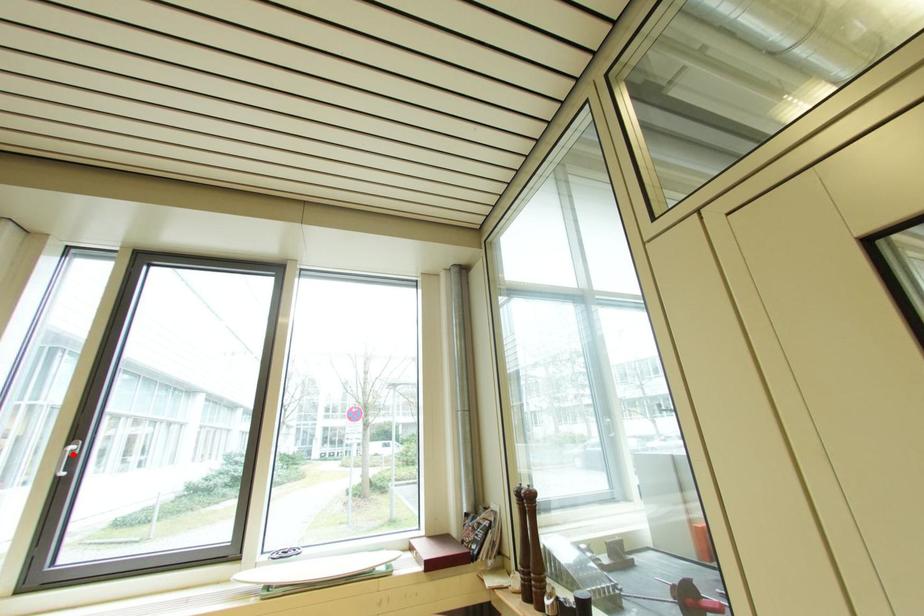
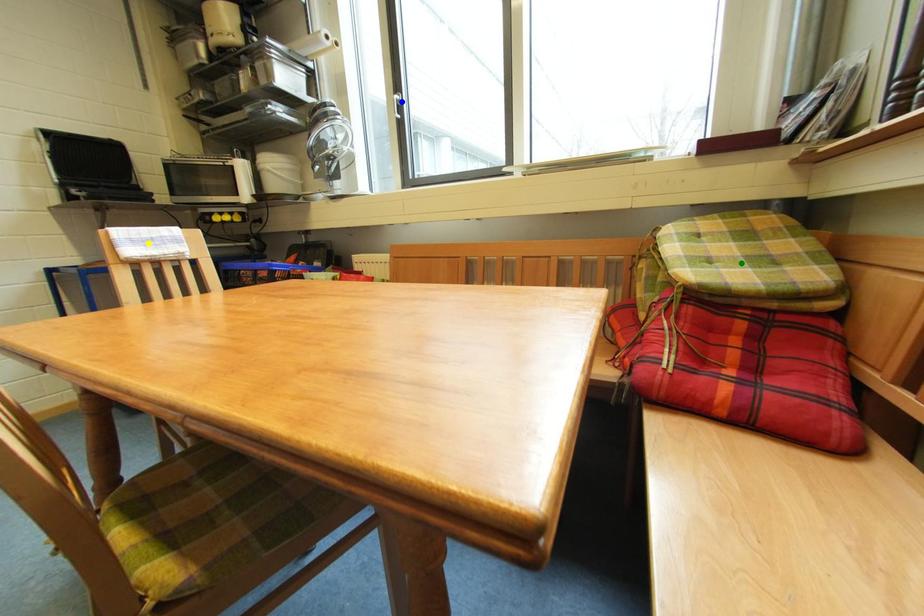
Question: I am providing you with two images of the same scene from different viewpoints. A red point is marked on the first image. You are given multiple points on the second image. Which point in image 2 is actually the same real-world point as the red point in image 1?

Choices:
 (A) green point
 (B) yellow point
 (C) blue point

Answer: (C)